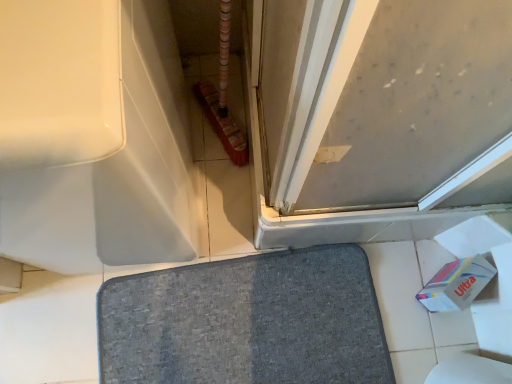
Question: Can you confirm if white cardboard toilet paper at lower right is bigger than matte gray screen door at upper right?

Choices:
 (A) no
 (B) yes

Answer: (A)

Question: From the image's perspective, would you say white cardboard toilet paper at lower right is positioned over matte gray screen door at upper right?

Choices:
 (A) no
 (B) yes

Answer: (A)

Question: Is white cardboard toilet paper at lower right not within matte gray screen door at upper right?

Choices:
 (A) yes
 (B) no

Answer: (A)

Question: Are white cardboard toilet paper at lower right and matte gray screen door at upper right located far from each other?

Choices:
 (A) no
 (B) yes

Answer: (A)

Question: Are white cardboard toilet paper at lower right and matte gray screen door at upper right making contact?

Choices:
 (A) yes
 (B) no

Answer: (B)

Question: Looking at the image, does gray fabric bath mat at center seem bigger or smaller compared to matte gray screen door at upper right?

Choices:
 (A) small
 (B) big

Answer: (A)

Question: Is gray fabric bath mat at center inside the boundaries of matte gray screen door at upper right, or outside?

Choices:
 (A) outside
 (B) inside

Answer: (A)

Question: From a real-world perspective, is gray fabric bath mat at center above or below matte gray screen door at upper right?

Choices:
 (A) below
 (B) above

Answer: (A)

Question: In terms of width, does gray fabric bath mat at center look wider or thinner when compared to matte gray screen door at upper right?

Choices:
 (A) thin
 (B) wide

Answer: (B)

Question: From the image's perspective, is matte gray screen door at upper right positioned above or below gray fabric bath mat at center?

Choices:
 (A) above
 (B) below

Answer: (A)

Question: From a real-world perspective, is matte gray screen door at upper right above or below gray fabric bath mat at center?

Choices:
 (A) below
 (B) above

Answer: (B)

Question: Is matte gray screen door at upper right wider or thinner than gray fabric bath mat at center?

Choices:
 (A) thin
 (B) wide

Answer: (A)

Question: Considering their positions, is matte gray screen door at upper right located in front of or behind gray fabric bath mat at center?

Choices:
 (A) front
 (B) behind

Answer: (A)

Question: From a real-world perspective, is gray fabric bath mat at center physically located above or below white cardboard toilet paper at lower right?

Choices:
 (A) below
 (B) above

Answer: (A)

Question: Considering their positions, is gray fabric bath mat at center located in front of or behind white cardboard toilet paper at lower right?

Choices:
 (A) behind
 (B) front

Answer: (A)